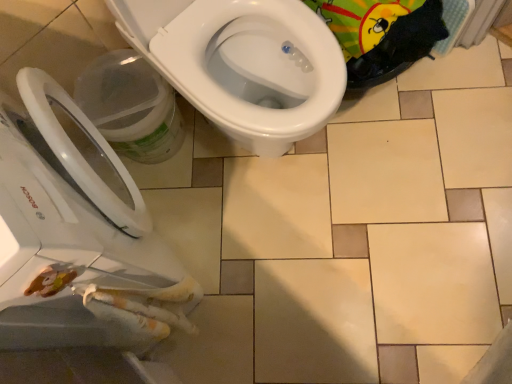
Question: From a real-world perspective, is white glossy toilet at upper center positioned above or below white glossy bidet at center?

Choices:
 (A) above
 (B) below

Answer: (A)

Question: Considering the positions of white glossy toilet at upper center and white glossy bidet at center in the image, is white glossy toilet at upper center taller or shorter than white glossy bidet at center?

Choices:
 (A) tall
 (B) short

Answer: (A)

Question: Considering the real-world distances, which object is farthest from the white glossy bidet at center?

Choices:
 (A) transparent plastic bucket at lower left
 (B) white glossy toilet at upper center

Answer: (B)

Question: Estimate the real-world distances between objects in this image. Which object is farther from the white glossy toilet at upper center?

Choices:
 (A) white glossy bidet at center
 (B) transparent plastic bucket at lower left

Answer: (A)